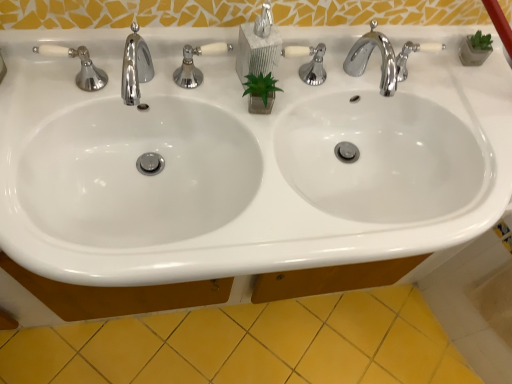
Locate an element on the screen. matte gray soap dispenser at center is located at coordinates (258, 45).

The height and width of the screenshot is (384, 512). What do you see at coordinates (382, 59) in the screenshot?
I see `polished chrome faucet at upper right, arranged as the first tap when viewed from the right` at bounding box center [382, 59].

What is the approximate width of polished chrome faucet at upper right, arranged as the first tap when viewed from the right?

polished chrome faucet at upper right, arranged as the first tap when viewed from the right, is 8.11 inches in width.

In order to face white glossy mirror at upper center, should I rotate leftwards or rightwards?

You should look right and rotate roughly 3.804 degrees.

Find the location of a particular element. white glossy sink at center is located at coordinates (245, 160).

Between white glossy mirror at upper center and polished chrome faucet at upper right, arranged as the first tap when viewed from the right, which one appears on the left side from the viewer's perspective?

white glossy mirror at upper center is more to the left.

From a real-world perspective, which is physically below, white glossy mirror at upper center or polished chrome faucet at upper right, acting as the second tap starting from the left?

From a 3D spatial view, polished chrome faucet at upper right, acting as the second tap starting from the left, is below.

Would you say white glossy mirror at upper center is a long distance from polished chrome faucet at upper right, arranged as the first tap when viewed from the right?

No, there isn't a large distance between white glossy mirror at upper center and polished chrome faucet at upper right, arranged as the first tap when viewed from the right.

Which is correct: white glossy mirror at upper center is inside polished chrome faucet at upper right, arranged as the first tap when viewed from the right, or outside of it?

white glossy mirror at upper center lies outside polished chrome faucet at upper right, arranged as the first tap when viewed from the right.

Is polished chrome faucet at upper left, which is the 2th tap from right to left, positioned in front of white glossy sink at center?

No, the depth of polished chrome faucet at upper left, which is the 2th tap from right to left, is greater than that of white glossy sink at center.

Which of these two, polished chrome faucet at upper left, which is the 2th tap from right to left, or white glossy sink at center, is wider?

white glossy sink at center.

From the image's perspective, is polished chrome faucet at upper left, the 1th tap positioned from the left, above or below white glossy sink at center?

From the image's perspective, polished chrome faucet at upper left, the 1th tap positioned from the left, appears above white glossy sink at center.

How far apart are polished chrome faucet at upper left, which is the 2th tap from right to left, and white glossy sink at center?

polished chrome faucet at upper left, which is the 2th tap from right to left, is 13.59 inches away from white glossy sink at center.

Which of these two, polished chrome faucet at upper right, arranged as the first tap when viewed from the right, or polished chrome faucet at upper left, the 1th tap positioned from the left, is bigger?

polished chrome faucet at upper right, arranged as the first tap when viewed from the right, is bigger.

From a real-world perspective, is polished chrome faucet at upper right, acting as the second tap starting from the left, under polished chrome faucet at upper left, the 1th tap positioned from the left?

Actually, polished chrome faucet at upper right, acting as the second tap starting from the left, is physically above polished chrome faucet at upper left, the 1th tap positioned from the left, in the real world.

Find the location of `tap above the polished chrome faucet at upper left, the 1th tap positioned from the left (from a real-world perspective)`. tap above the polished chrome faucet at upper left, the 1th tap positioned from the left (from a real-world perspective) is located at coordinates (382, 59).

Does polished chrome faucet at upper right, arranged as the first tap when viewed from the right, contain polished chrome faucet at upper left, which is the 2th tap from right to left?

No, polished chrome faucet at upper left, which is the 2th tap from right to left, is located outside of polished chrome faucet at upper right, arranged as the first tap when viewed from the right.

Is polished chrome faucet at upper right, acting as the second tap starting from the left, located outside white glossy sink at center?

Indeed, polished chrome faucet at upper right, acting as the second tap starting from the left, is completely outside white glossy sink at center.

In the scene shown: Does polished chrome faucet at upper right, arranged as the first tap when viewed from the right, turn towards white glossy sink at center?

No, polished chrome faucet at upper right, arranged as the first tap when viewed from the right, is not turned towards white glossy sink at center.

Would you consider polished chrome faucet at upper right, acting as the second tap starting from the left, to be distant from white glossy sink at center?

Actually, polished chrome faucet at upper right, acting as the second tap starting from the left, and white glossy sink at center are a little close together.

How many degrees apart are the facing directions of polished chrome faucet at upper right, arranged as the first tap when viewed from the right, and white glossy sink at center?

The angle between the facing direction of polished chrome faucet at upper right, arranged as the first tap when viewed from the right, and the facing direction of white glossy sink at center is 1.92 degrees.

From a real-world perspective, does polished chrome faucet at upper right, arranged as the first tap when viewed from the right, sit lower than matte gray soap dispenser at center?

Yes, from a real-world perspective, polished chrome faucet at upper right, arranged as the first tap when viewed from the right, is under matte gray soap dispenser at center.

How many degrees apart are the facing directions of polished chrome faucet at upper right, acting as the second tap starting from the left, and matte gray soap dispenser at center?

polished chrome faucet at upper right, acting as the second tap starting from the left, and matte gray soap dispenser at center are facing 9.7 degrees away from each other.

Is polished chrome faucet at upper right, acting as the second tap starting from the left, not inside matte gray soap dispenser at center?

Absolutely, polished chrome faucet at upper right, acting as the second tap starting from the left, is external to matte gray soap dispenser at center.

From the image's perspective, is polished chrome faucet at upper right, arranged as the first tap when viewed from the right, located above or below matte gray soap dispenser at center?

polished chrome faucet at upper right, arranged as the first tap when viewed from the right, is below matte gray soap dispenser at center.

This screenshot has width=512, height=384. Identify the location of ceramic tile on the left side of matte gray soap dispenser at center. (248, 345).

Is point (270, 20) positioned in front of point (50, 381)?

Yes, point (270, 20) is in front of point (50, 381).

Based on the photo, who is shorter, matte gray soap dispenser at center or yellow ceramic tile at lower center?

Standing shorter between the two is yellow ceramic tile at lower center.

Is matte gray soap dispenser at center behind yellow ceramic tile at lower center?

No.

Relative to white glossy sink at center, is matte gray soap dispenser at center in front or behind?

Clearly, matte gray soap dispenser at center is behind white glossy sink at center.

Is matte gray soap dispenser at center to the left or to the right of white glossy sink at center in the image?

Clearly, matte gray soap dispenser at center is on the right of white glossy sink at center in the image.

Where is `soap dispenser above the white glossy sink at center (from the image's perspective)`? The height and width of the screenshot is (384, 512). soap dispenser above the white glossy sink at center (from the image's perspective) is located at coordinates (258, 45).

Does matte gray soap dispenser at center have a greater width compared to white glossy sink at center?

Incorrect, the width of matte gray soap dispenser at center does not surpass that of white glossy sink at center.

This screenshot has width=512, height=384. Identify the location of tap that is the 1st one below the white glossy mirror at upper center (from a real-world perspective). (382, 59).

Where is `tap on the left side of white glossy sink at center`? tap on the left side of white glossy sink at center is located at coordinates (135, 68).

When comparing their distances from yellow ceramic tile at lower center, does white glossy sink at center or polished chrome faucet at upper left, the 1th tap positioned from the left, seem closer?

Based on the image, white glossy sink at center appears to be nearer to yellow ceramic tile at lower center.

When comparing their distances from polished chrome faucet at upper left, the 1th tap positioned from the left, does white glossy sink at center or matte gray soap dispenser at center seem closer?

Based on the image, matte gray soap dispenser at center appears to be nearer to polished chrome faucet at upper left, the 1th tap positioned from the left.

Which object lies nearer to the anchor point white glossy sink at center, matte gray soap dispenser at center or white glossy mirror at upper center?

Based on the image, white glossy mirror at upper center appears to be nearer to white glossy sink at center.

Considering their positions, is white glossy sink at center positioned further to polished chrome faucet at upper right, acting as the second tap starting from the left, than white glossy mirror at upper center?

white glossy sink at center.

Considering their positions, is yellow ceramic tile at lower center positioned further to polished chrome faucet at upper right, arranged as the first tap when viewed from the right, than matte gray soap dispenser at center?

yellow ceramic tile at lower center is positioned further to the anchor polished chrome faucet at upper right, arranged as the first tap when viewed from the right.

Estimate the real-world distances between objects in this image. Which object is closer to polished chrome faucet at upper left, which is the 2th tap from right to left, yellow ceramic tile at lower center or polished chrome faucet at upper right, acting as the second tap starting from the left?

A: The object closer to polished chrome faucet at upper left, which is the 2th tap from right to left, is polished chrome faucet at upper right, acting as the second tap starting from the left.

From the image, which object appears to be farther from polished chrome faucet at upper left, which is the 2th tap from right to left, polished chrome faucet at upper right, arranged as the first tap when viewed from the right, or white glossy sink at center?

Based on the image, polished chrome faucet at upper right, arranged as the first tap when viewed from the right, appears to be further to polished chrome faucet at upper left, which is the 2th tap from right to left.

From the image, which object appears to be farther from polished chrome faucet at upper left, which is the 2th tap from right to left, matte gray soap dispenser at center or yellow ceramic tile at lower center?

yellow ceramic tile at lower center is positioned further to the anchor polished chrome faucet at upper left, which is the 2th tap from right to left.

The image size is (512, 384). Find the location of `soap dispenser between white glossy mirror at upper center and yellow ceramic tile at lower center vertically`. soap dispenser between white glossy mirror at upper center and yellow ceramic tile at lower center vertically is located at coordinates (258, 45).

Locate an element on the screen. soap dispenser located between polished chrome faucet at upper left, the 1th tap positioned from the left, and polished chrome faucet at upper right, arranged as the first tap when viewed from the right, in the left-right direction is located at coordinates (258, 45).

Where is `sink between polished chrome faucet at upper left, the 1th tap positioned from the left, and yellow ceramic tile at lower center from top to bottom`? sink between polished chrome faucet at upper left, the 1th tap positioned from the left, and yellow ceramic tile at lower center from top to bottom is located at coordinates (245, 160).

The width and height of the screenshot is (512, 384). I want to click on sink between white glossy mirror at upper center and yellow ceramic tile at lower center in the vertical direction, so click(245, 160).